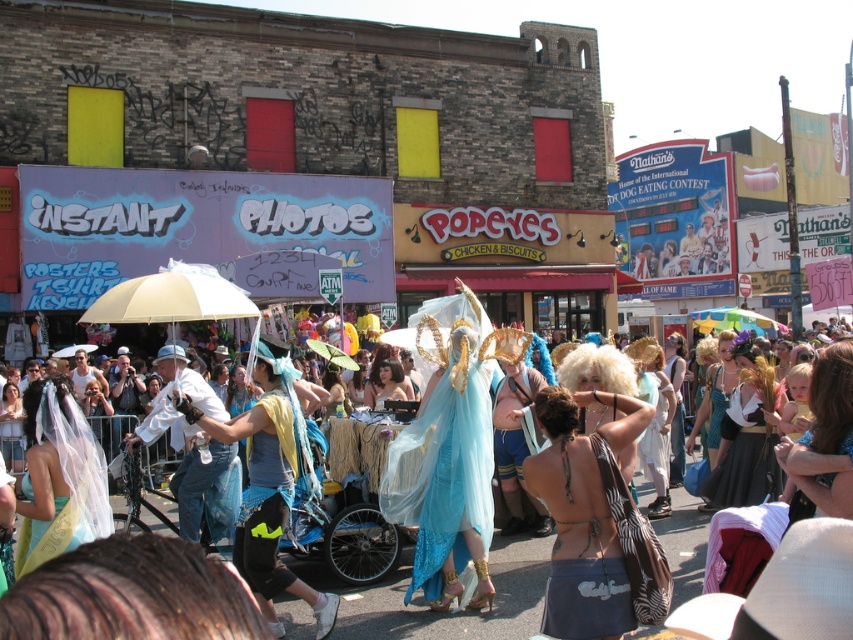
Between translucent blue fabric at center and white matte umbrella at center, which one has less height?

translucent blue fabric at center is shorter.

Between point (520, 632) and point (134, 433), which one is positioned in front?

Positioned in front is point (520, 632).

The height and width of the screenshot is (640, 853). Identify the location of translucent blue fabric at center. (445, 612).

The height and width of the screenshot is (640, 853). What do you see at coordinates (445, 612) in the screenshot? I see `translucent blue fabric at center` at bounding box center [445, 612].

Which is more to the left, translucent blue fabric at center or beige fabric umbrella at center?

beige fabric umbrella at center

Is point (387, 442) farther from viewer compared to point (171, 316)?

Yes, it is.

I want to click on translucent blue fabric at center, so click(x=445, y=612).

Which of these two, blue fabric dress at center or rainbow fabric umbrella at center, stands taller?

rainbow fabric umbrella at center is taller.

Is blue fabric dress at center to the left of rainbow fabric umbrella at center from the viewer's perspective?

Yes, blue fabric dress at center is to the left of rainbow fabric umbrella at center.

Identify the location of blue fabric dress at center. pos(270,483).